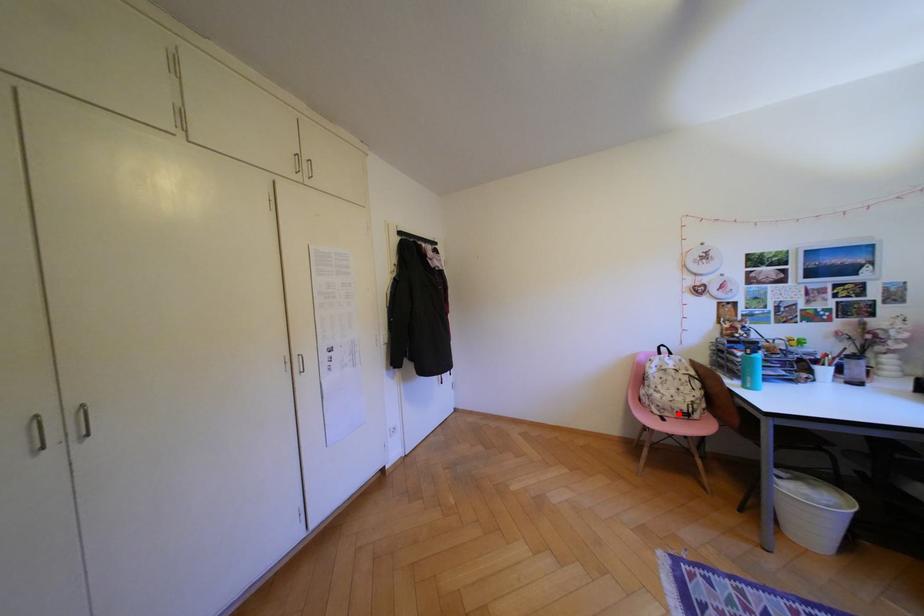
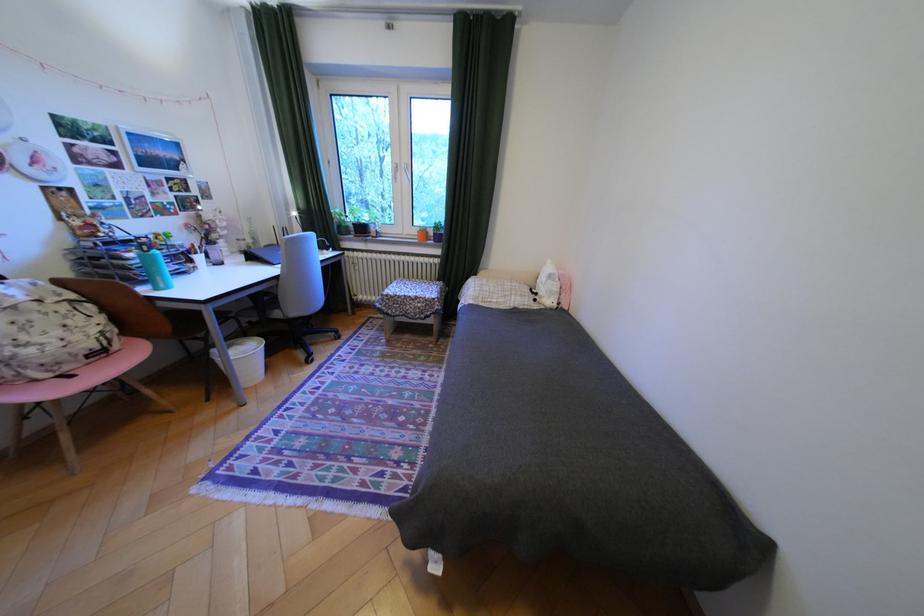
Locate, in the second image, the point that corresponds to the highlighted location in the first image.

(79, 368)